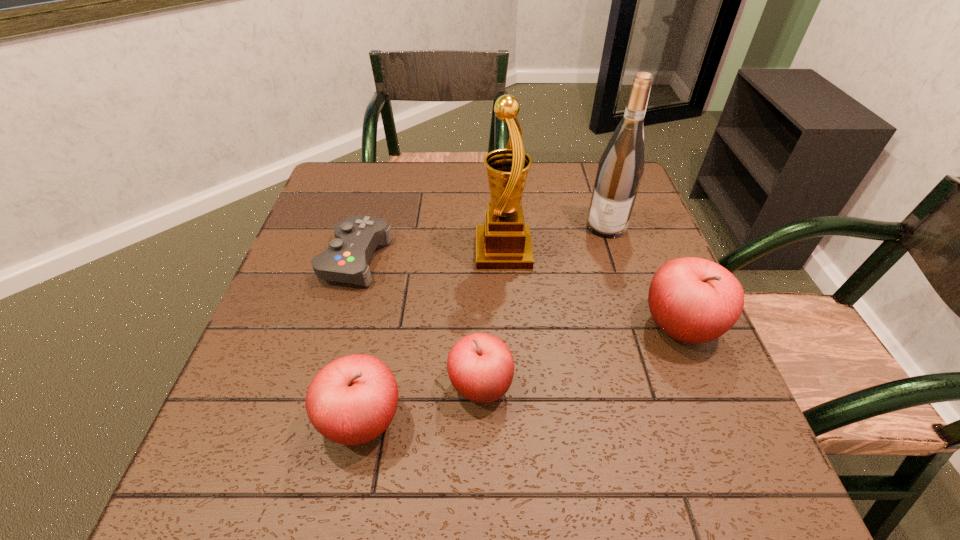
To achieve even spacing by inserting another apple among them, please point to a vacant spot for this new apple. Please provide its 2D coordinates. Your answer should be formatted as a tuple, i.e. [(x, y)], where the tuple contains the x and y coordinates of a point satisfying the conditions above.

[(586, 355)]